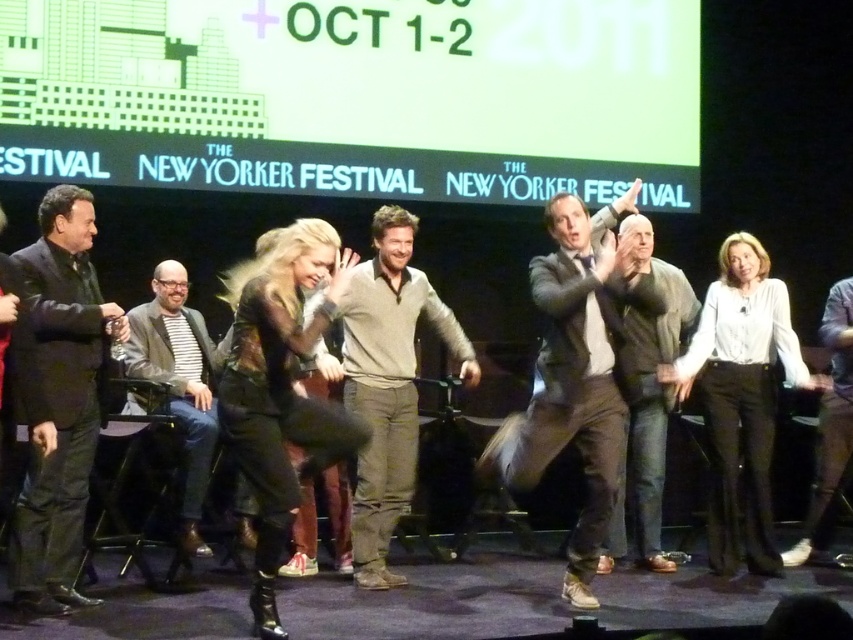
Can you confirm if brown leather jacket at center is bigger than black suit at left?

Indeed, brown leather jacket at center has a larger size compared to black suit at left.

Is brown leather jacket at center smaller than black suit at left?

Actually, brown leather jacket at center might be larger than black suit at left.

Which is behind, point (572, 381) or point (45, 294)?

The point (572, 381) is more distant.

This screenshot has height=640, width=853. Identify the location of brown leather jacket at center. (576, 372).

Can you confirm if light brown sweater at center is taller than dark gray sweater at center?

In fact, light brown sweater at center may be shorter than dark gray sweater at center.

Which is below, light brown sweater at center or dark gray sweater at center?

Positioned lower is dark gray sweater at center.

Which is behind, point (402, 323) or point (686, 316)?

The point (686, 316) is more distant.

Where is `light brown sweater at center`? light brown sweater at center is located at coordinates [x=387, y=384].

This screenshot has width=853, height=640. In order to click on leather jacket at center in this screenshot , I will do `click(280, 387)`.

Does leather jacket at center have a lesser height compared to striped fabric shirt at center?

No.

Is point (334, 419) positioned in front of point (143, 342)?

That is True.

The height and width of the screenshot is (640, 853). What are the coordinates of `leather jacket at center` in the screenshot? It's located at (280, 387).